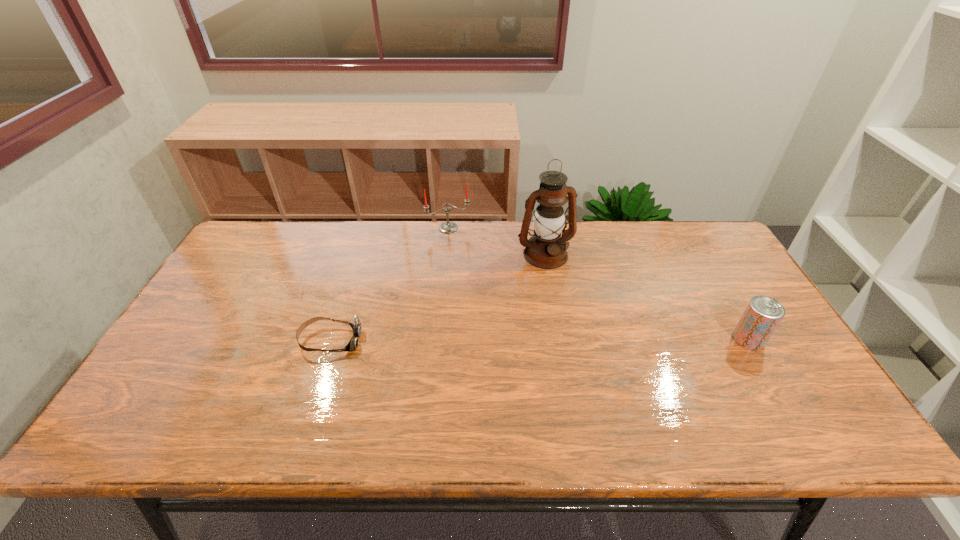
You are a GUI agent. You are given a task and a screenshot of the screen. Output one action in this format:
    pyautogui.click(x=<x>, y=<y>)
    Task: Click on the blank region between the shortest object and the third tallest object
    This screenshot has height=540, width=960.
    Given the screenshot: What is the action you would take?
    pyautogui.click(x=540, y=340)

The image size is (960, 540). I want to click on vacant space in between the third object from right to left and the shortest object, so click(389, 284).

Find the location of a particular element. free space between the beer can and the farthest object is located at coordinates (598, 284).

Identify which object is the second closest to the rightmost object. Please provide its 2D coordinates. Your answer should be formatted as a tuple, i.e. [(x, y)], where the tuple contains the x and y coordinates of a point satisfying the conditions above.

[(447, 227)]

You are a GUI agent. You are given a task and a screenshot of the screen. Output one action in this format:
    pyautogui.click(x=<x>, y=<y>)
    Task: Click on the object that stands as the third closest to the second object from left to right
    This screenshot has height=540, width=960.
    Given the screenshot: What is the action you would take?
    pyautogui.click(x=763, y=314)